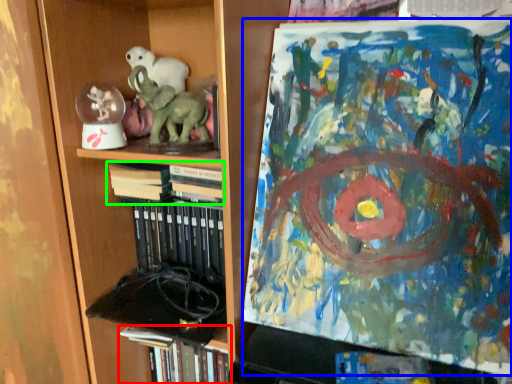
Question: Which object is positioned closest to book (highlighted by a red box)? Select from art (highlighted by a blue box) and book (highlighted by a green box).

Choices:
 (A) art
 (B) book

Answer: (B)